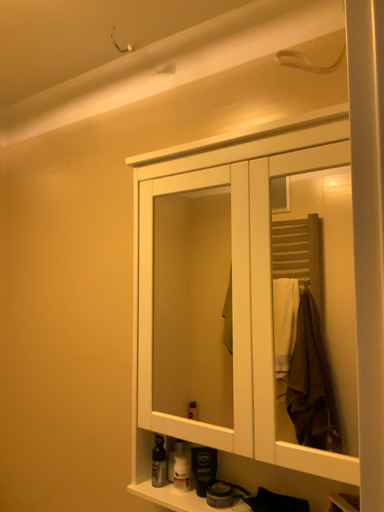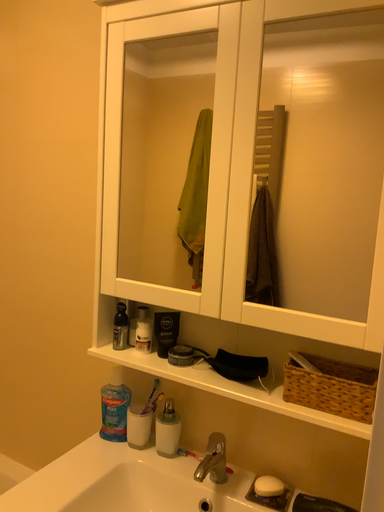
Question: How did the camera likely rotate when shooting the video?

Choices:
 (A) rotated upward
 (B) rotated downward

Answer: (B)